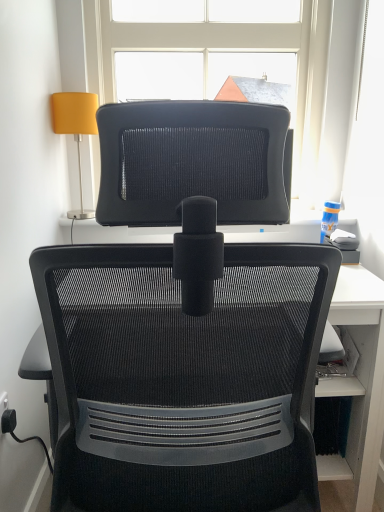
Question: From the image's perspective, is matte yellow fabric lampshade at upper left located beneath black plastic plug at lower left?

Choices:
 (A) yes
 (B) no

Answer: (B)

Question: Is matte yellow fabric lampshade at upper left further to the viewer compared to black plastic plug at lower left?

Choices:
 (A) yes
 (B) no

Answer: (A)

Question: Is matte yellow fabric lampshade at upper left thinner than black plastic plug at lower left?

Choices:
 (A) no
 (B) yes

Answer: (A)

Question: From a real-world perspective, is matte yellow fabric lampshade at upper left over black plastic plug at lower left?

Choices:
 (A) no
 (B) yes

Answer: (B)

Question: Is matte yellow fabric lampshade at upper left directly adjacent to black plastic plug at lower left?

Choices:
 (A) no
 (B) yes

Answer: (A)

Question: Considering the relative sizes of matte yellow fabric lampshade at upper left and black plastic plug at lower left in the image provided, is matte yellow fabric lampshade at upper left wider than black plastic plug at lower left?

Choices:
 (A) yes
 (B) no

Answer: (A)

Question: From the image's perspective, is black mesh chair at center on top of matte yellow fabric lampshade at upper left?

Choices:
 (A) no
 (B) yes

Answer: (A)

Question: Does black mesh chair at center have a larger size compared to matte yellow fabric lampshade at upper left?

Choices:
 (A) yes
 (B) no

Answer: (A)

Question: Considering the relative sizes of black mesh chair at center and matte yellow fabric lampshade at upper left in the image provided, is black mesh chair at center thinner than matte yellow fabric lampshade at upper left?

Choices:
 (A) yes
 (B) no

Answer: (B)

Question: From a real-world perspective, is black mesh chair at center beneath matte yellow fabric lampshade at upper left?

Choices:
 (A) no
 (B) yes

Answer: (B)

Question: Is black mesh chair at center oriented towards matte yellow fabric lampshade at upper left?

Choices:
 (A) no
 (B) yes

Answer: (B)

Question: From the image's perspective, is black mesh chair at center below matte yellow fabric lampshade at upper left?

Choices:
 (A) yes
 (B) no

Answer: (A)

Question: Is transparent glass window at upper center a part of matte yellow fabric lampshade at upper left?

Choices:
 (A) yes
 (B) no

Answer: (B)